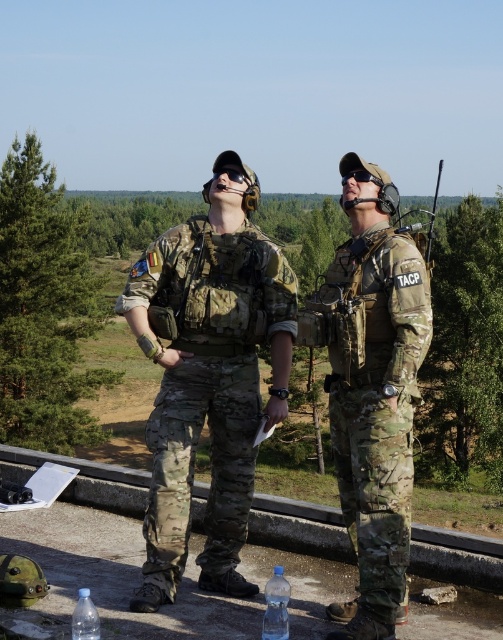
You are a drone operator trying to determine the best vantage point for surveillance. You see two points in the image labeled as point (81,609) and point (376,184). Which point is closer to your current position?

Point (81,609) is closer to the viewer than point (376,184), so the closer point is point (81,609).

You are a photographer taking a picture of the scene. You notice the camouflage uniform at center and the transparent plastic bottle at lower left. Which object should you focus on first to ensure it appears sharp in the foreground?

The transparent plastic bottle at lower left should be focused on first because it is in the foreground, closer to the camera than the camouflage uniform at center which is further back.

You are a photographer trying to capture both the camouflage uniform at center and the transparent plastic bottle at lower left in a single shot. Based on their positions, which object should you adjust your camera angle to focus on first to ensure both are in frame?

The camouflage uniform at center is to the right of transparent plastic bottle at lower left, so you should focus on the transparent plastic bottle at lower left first to ensure both are in frame.